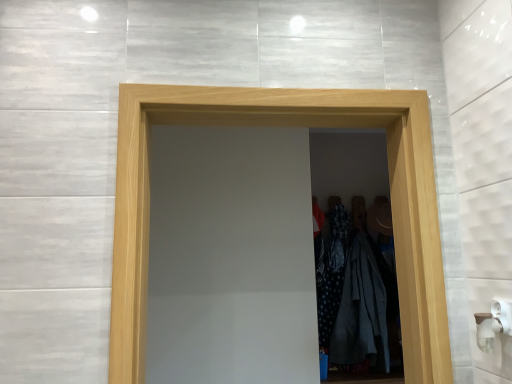
Describe the element at coordinates (290, 126) in the screenshot. The height and width of the screenshot is (384, 512). I see `wooden door at center` at that location.

Locate an element on the screen. The height and width of the screenshot is (384, 512). wooden door at center is located at coordinates (290, 126).

This screenshot has height=384, width=512. Describe the element at coordinates (332, 272) in the screenshot. I see `dark gray fabric coat at center` at that location.

Image resolution: width=512 pixels, height=384 pixels. Find the location of `dark gray fabric coat at center`. dark gray fabric coat at center is located at coordinates (332, 272).

Image resolution: width=512 pixels, height=384 pixels. Identify the location of wooden door at center. (290, 126).

Considering the positions of objects dark gray fabric coat at center and wooden door at center in the image provided, who is more to the left, dark gray fabric coat at center or wooden door at center?

Positioned to the left is wooden door at center.

Who is more distant, dark gray fabric coat at center or wooden door at center?

dark gray fabric coat at center.

Is point (327, 327) more distant than point (343, 105)?

That is True.

From the image's perspective, which object appears higher, dark gray fabric coat at center or wooden door at center?

wooden door at center, from the image's perspective.

From a real-world perspective, who is located lower, dark gray fabric coat at center or wooden door at center?

dark gray fabric coat at center is physically lower.

Considering the relative sizes of dark gray fabric coat at center and wooden door at center in the image provided, is dark gray fabric coat at center wider than wooden door at center?

No, dark gray fabric coat at center is not wider than wooden door at center.

Considering the sizes of objects dark gray fabric coat at center and wooden door at center in the image provided, who is shorter, dark gray fabric coat at center or wooden door at center?

With less height is dark gray fabric coat at center.

Can you confirm if dark gray fabric coat at center is smaller than wooden door at center?

Yes, dark gray fabric coat at center is smaller than wooden door at center.

Would you say dark gray fabric coat at center is inside or outside wooden door at center?

The correct answer is: outside.

Are dark gray fabric coat at center and wooden door at center far apart?

dark gray fabric coat at center is far away from wooden door at center.

Is dark gray fabric coat at center aimed at wooden door at center?

No, dark gray fabric coat at center is not oriented towards wooden door at center.

What's the angular difference between dark gray fabric coat at center and wooden door at center's facing directions?

3.47 degrees separate the facing orientations of dark gray fabric coat at center and wooden door at center.

This screenshot has height=384, width=512. What are the coordinates of `clothing located behind the wooden door at center` in the screenshot? It's located at pyautogui.click(x=332, y=272).

Which object is positioned more to the left, wooden door at center or dark gray fabric coat at center?

wooden door at center is more to the left.

Who is more distant, wooden door at center or dark gray fabric coat at center?

dark gray fabric coat at center is further away from the camera.

Is point (374, 90) positioned after point (319, 267)?

No, it is not.

From the image's perspective, is wooden door at center on top of dark gray fabric coat at center?

Yes.

From a real-world perspective, relative to dark gray fabric coat at center, is wooden door at center vertically above or below?

wooden door at center is above dark gray fabric coat at center.

Between wooden door at center and dark gray fabric coat at center, which one has smaller width?

Thinner between the two is dark gray fabric coat at center.

Is wooden door at center taller or shorter than dark gray fabric coat at center?

In the image, wooden door at center appears to be taller than dark gray fabric coat at center.

Looking at this image, is wooden door at center smaller than dark gray fabric coat at center?

Actually, wooden door at center might be larger than dark gray fabric coat at center.

Is dark gray fabric coat at center located within wooden door at center?

No, dark gray fabric coat at center is located outside of wooden door at center.

Is wooden door at center beside dark gray fabric coat at center?

They are not placed beside each other.

Is wooden door at center positioned with its back to dark gray fabric coat at center?

Absolutely, wooden door at center is directed away from dark gray fabric coat at center.

Measure the distance between wooden door at center and dark gray fabric coat at center.

wooden door at center and dark gray fabric coat at center are 2.00 meters apart.

This screenshot has height=384, width=512. Find the location of `door above the dark gray fabric coat at center (from a real-world perspective)`. door above the dark gray fabric coat at center (from a real-world perspective) is located at coordinates (290, 126).

Find the location of a particular element. The width and height of the screenshot is (512, 384). clothing behind the wooden door at center is located at coordinates (332, 272).

This screenshot has width=512, height=384. In order to click on clothing on the right of the wooden door at center in this screenshot , I will do `click(332, 272)`.